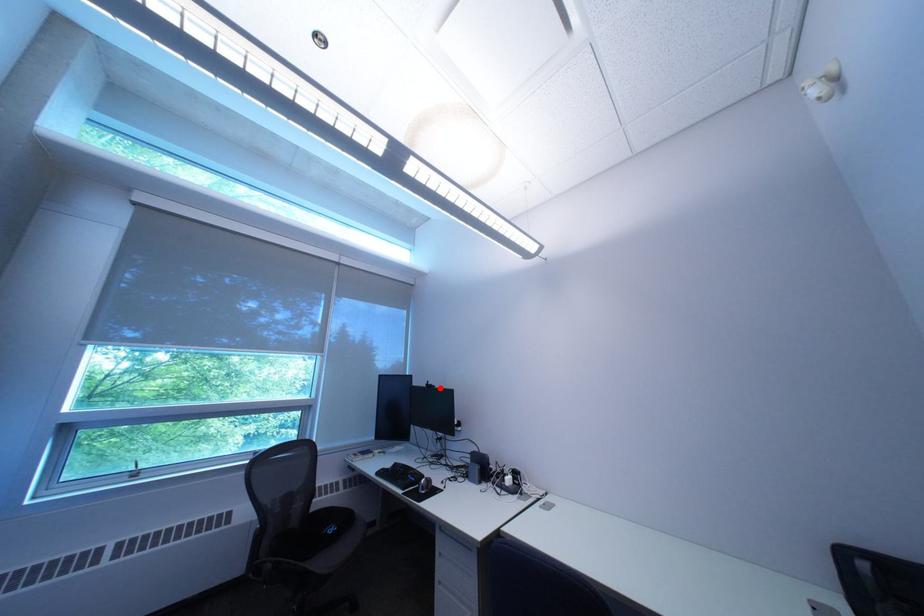
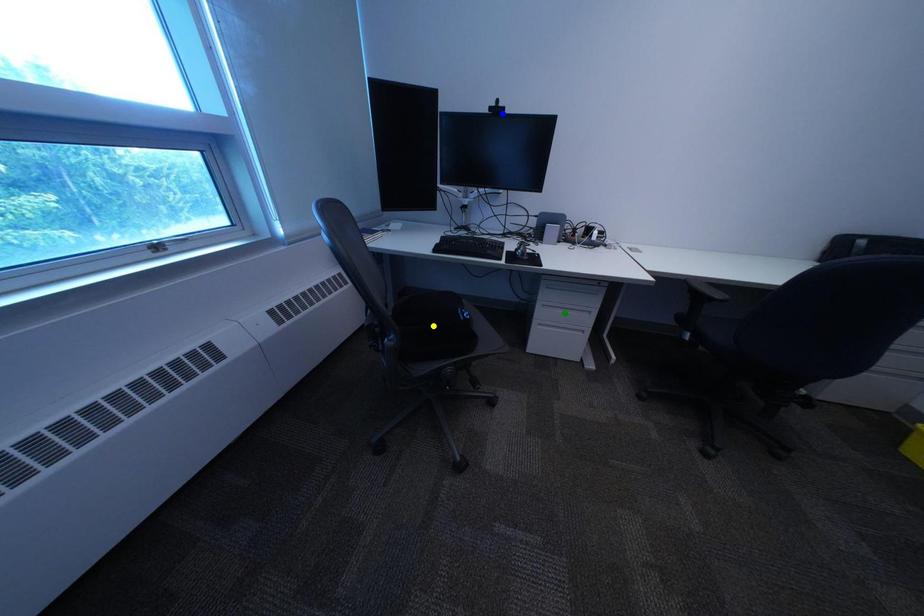
Question: I am providing you with two images of the same scene from different viewpoints. A red point is marked on the first image. You are given multiple points on the second image. Can you choose the point in image 2 that corresponds to the point in image 1?

Choices:
 (A) yellow point
 (B) green point
 (C) blue point

Answer: (C)